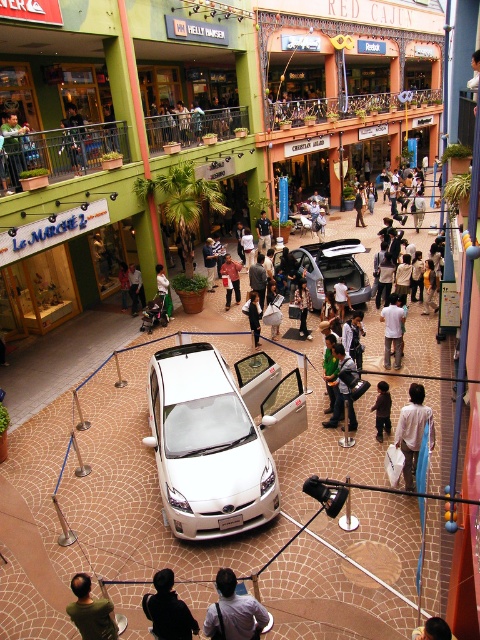
Measure the distance from green fabric backpack at center to brown fabric pants at center.

The distance of green fabric backpack at center from brown fabric pants at center is 64.30 centimeters.

What do you see at coordinates (342, 406) in the screenshot? I see `green fabric backpack at center` at bounding box center [342, 406].

This screenshot has height=640, width=480. I want to click on green fabric backpack at center, so click(x=342, y=406).

Who is positioned more to the left, orange fabric shirt at center or white cotton shirt at center?

orange fabric shirt at center

Is point (225, 276) more distant than point (257, 225)?

No, it is in front of (257, 225).

Does point (236, 298) come in front of point (265, 224)?

That is True.

At what (x,y) coordinates should I click in order to perform the action: click on orange fabric shirt at center. Please return your answer as a coordinate pair (x, y). Looking at the image, I should click on (230, 278).

Between light brown leather jacket at center and dark blue jeans at center, which one has less height?

dark blue jeans at center

Does light brown leather jacket at center have a smaller size compared to dark blue jeans at center?

No, light brown leather jacket at center is not smaller than dark blue jeans at center.

Which is in front, point (393, 310) or point (73, 166)?

Point (393, 310) is in front.

This screenshot has height=640, width=480. What are the coordinates of `light brown leather jacket at center` in the screenshot? It's located at tap(393, 330).